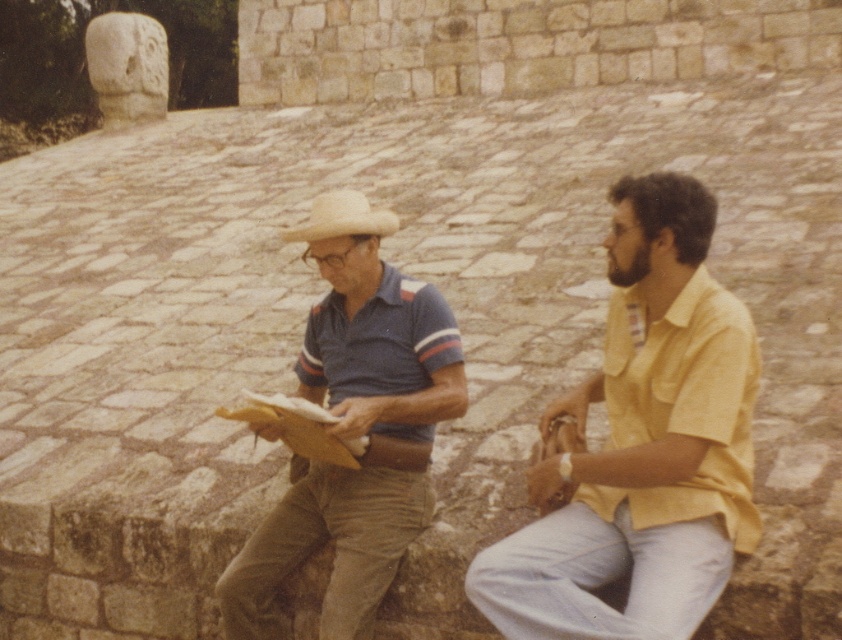
Question: Observing the image, what is the correct spatial positioning of blue striped polo shirt at center in reference to strawmaterial/texturecowboy hat at center?

Choices:
 (A) left
 (B) right

Answer: (B)

Question: Is the position of yellow cotton shirt at right more distant than that of blue striped polo shirt at center?

Choices:
 (A) no
 (B) yes

Answer: (A)

Question: Which of these objects is positioned closest to the blue striped polo shirt at center?

Choices:
 (A) strawmaterial/texturecowboy hat at center
 (B) yellow cotton shirt at right

Answer: (B)

Question: Among these objects, which one is nearest to the camera?

Choices:
 (A) yellow cotton shirt at right
 (B) strawmaterial/texturecowboy hat at center

Answer: (A)

Question: Which object is closer to the camera taking this photo?

Choices:
 (A) strawmaterial/texturecowboy hat at center
 (B) yellow cotton shirt at right
 (C) blue striped polo shirt at center

Answer: (B)

Question: Is yellow cotton shirt at right further to the viewer compared to blue striped polo shirt at center?

Choices:
 (A) yes
 (B) no

Answer: (B)